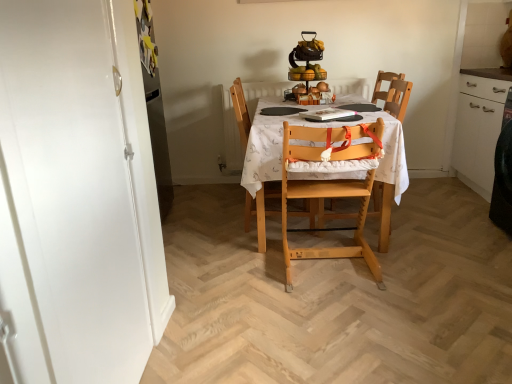
Where is `vacant space that's between white printed fabric at center and light wood highchair at center, acting as the 2th chair starting from the right`? vacant space that's between white printed fabric at center and light wood highchair at center, acting as the 2th chair starting from the right is located at coordinates (328, 267).